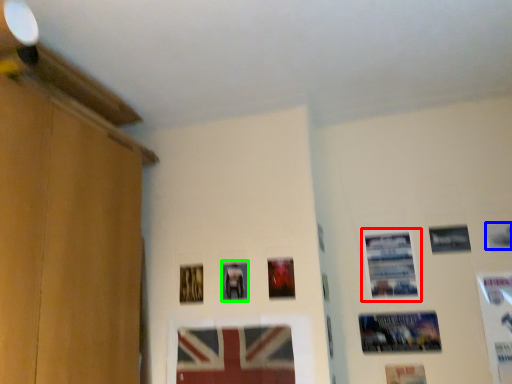
Question: Based on their relative distances, which object is nearer to picture frame (highlighted by a red box)? Choose from picture frame (highlighted by a blue box) and picture frame (highlighted by a green box).

Choices:
 (A) picture frame
 (B) picture frame

Answer: (A)